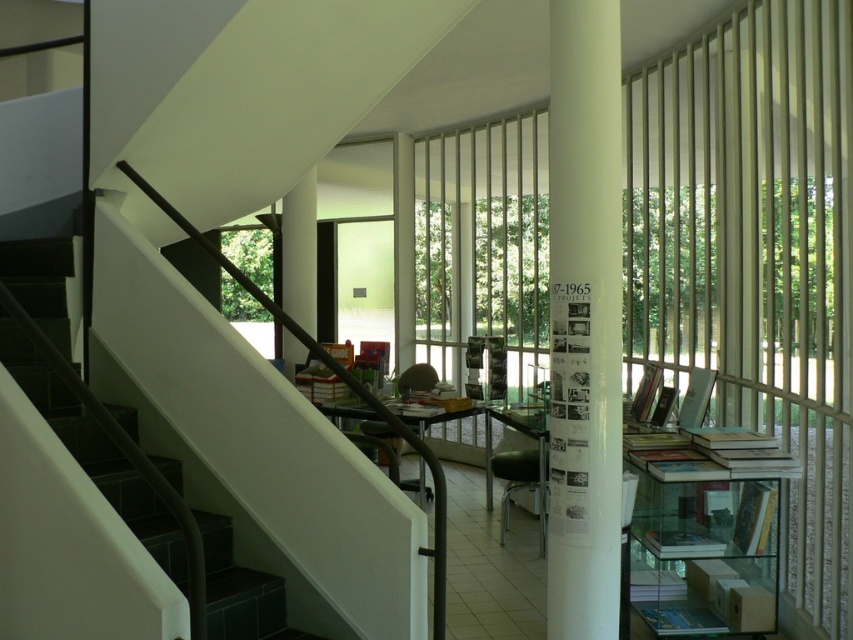
Between white glossy pillar at center and white glossy stairwell at left, which one appears on the right side from the viewer's perspective?

Positioned to the right is white glossy pillar at center.

Is white glossy pillar at center smaller than white glossy stairwell at left?

Indeed, white glossy pillar at center has a smaller size compared to white glossy stairwell at left.

The height and width of the screenshot is (640, 853). What do you see at coordinates (584, 321) in the screenshot?
I see `white glossy pillar at center` at bounding box center [584, 321].

Locate an element on the screen. This screenshot has height=640, width=853. white glossy pillar at center is located at coordinates (584, 321).

Which is below, white glossy stairwell at left or hardcover book at center?

hardcover book at center

Is point (44, 369) behind point (706, 374)?

No.

Find the location of a particular element. Image resolution: width=853 pixels, height=640 pixels. white glossy stairwell at left is located at coordinates (94, 451).

Can you confirm if white glossy pillar at center is wider than hardcover book at center?

Yes.

Can you confirm if white glossy pillar at center is thinner than hardcover book at center?

No, white glossy pillar at center is not thinner than hardcover book at center.

Is point (614, 170) more distant than point (700, 403)?

No, it is not.

Find the location of a particular element. The height and width of the screenshot is (640, 853). white glossy pillar at center is located at coordinates (584, 321).